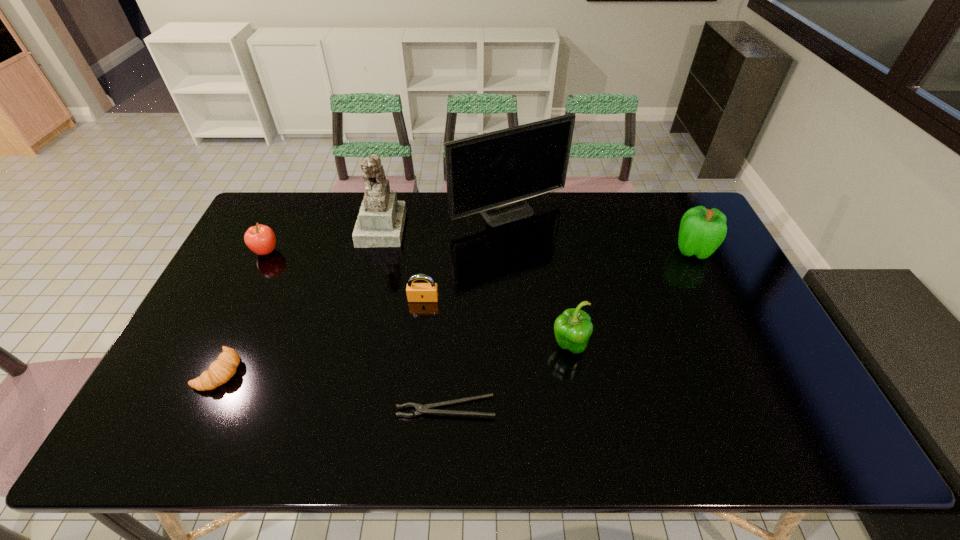
Where is `free region located on the front-facing side of the computer monitor`? The height and width of the screenshot is (540, 960). free region located on the front-facing side of the computer monitor is located at coordinates (516, 320).

Locate an element on the screen. The width and height of the screenshot is (960, 540). free point located on the front-facing side of the sixth object from right to left is located at coordinates (420, 227).

Identify the location of vacant space located 0.160m on the front of the farther bell pepper. (719, 302).

Where is `vacant region located 0.120m on the front of the nearer bell pepper`? This screenshot has width=960, height=540. vacant region located 0.120m on the front of the nearer bell pepper is located at coordinates (578, 404).

At what (x,y) coordinates should I click in order to perform the action: click on free location located on the back of the apple. Please return your answer as a coordinate pair (x, y). Image resolution: width=960 pixels, height=540 pixels. Looking at the image, I should click on (288, 208).

In order to click on blank space located 0.300m to unlock the padlock from the front in this screenshot , I will do `click(412, 395)`.

The height and width of the screenshot is (540, 960). I want to click on vacant space located on the left of the crescent roll, so click(x=180, y=371).

Identify the location of free spot located 0.070m on the back of the tongs. The width and height of the screenshot is (960, 540). (448, 370).

At what (x,y) coordinates should I click in order to perform the action: click on computer monitor positioned at the far edge. Please return your answer as a coordinate pair (x, y). Looking at the image, I should click on (492, 173).

I want to click on figurine that is at the far edge, so click(x=380, y=223).